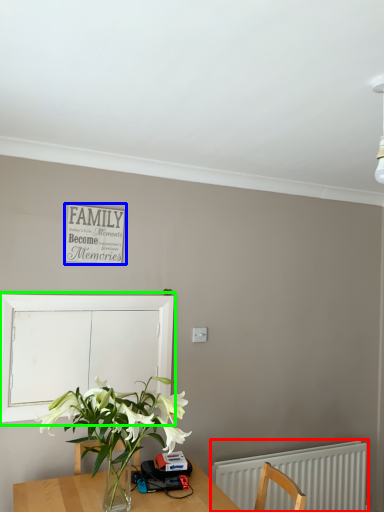
Question: Considering the real-world distances, which object is farthest from radiator (highlighted by a red box)? bulletin board (highlighted by a blue box) or window screen (highlighted by a green box)?

Choices:
 (A) bulletin board
 (B) window screen

Answer: (A)